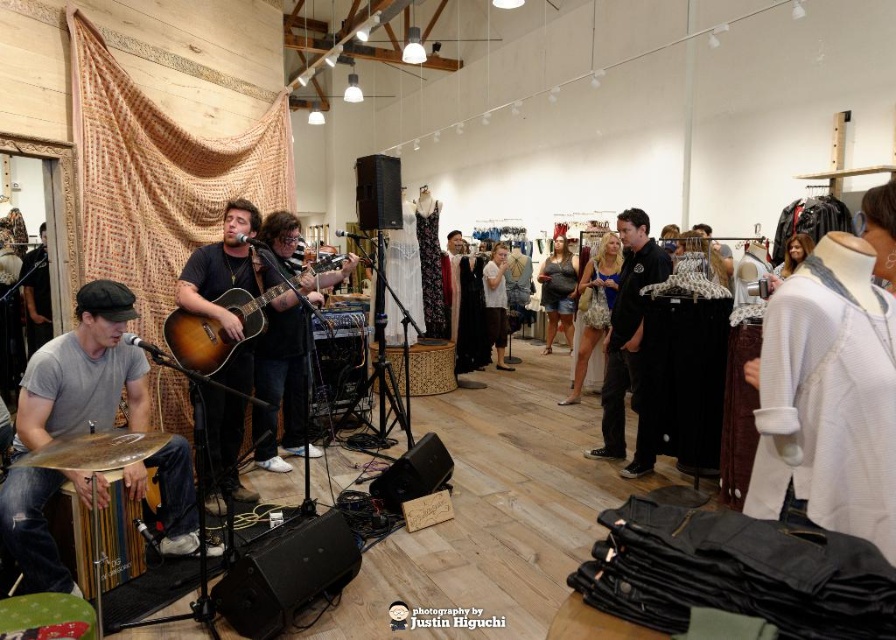
You are a photographer at the live music event and need to capture a photo of the black matte jacket at center and the sunburst wood acoustic guitar at center. Which object is located to the right of the other?

The black matte jacket at center is positioned on the right side of sunburst wood acoustic guitar at center.